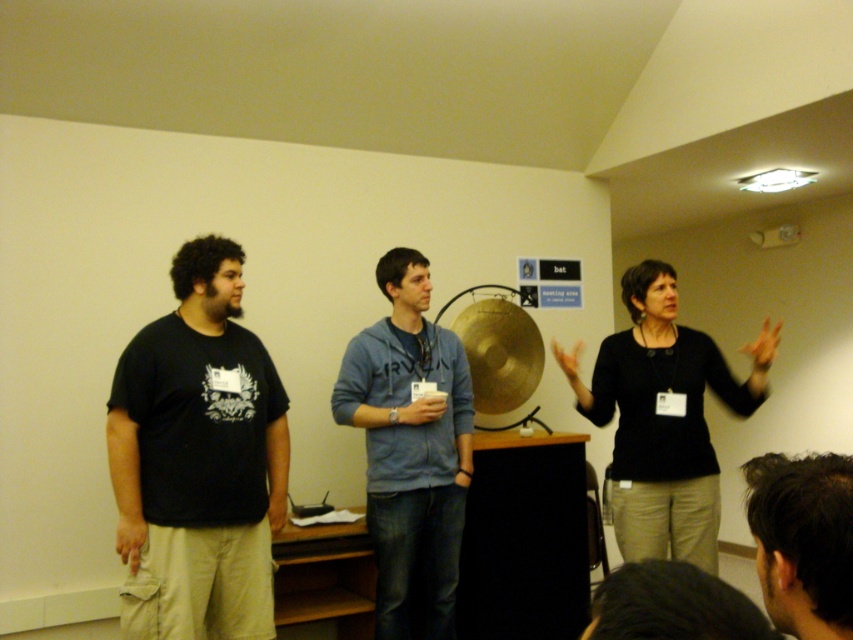
Question: Estimate the real-world distances between objects in this image. Which object is farther from the black matte t-shirt at left?

Choices:
 (A) blue cotton hoodie at center
 (B) gold metallic cymbal at center
 (C) dark brown hair at lower right
 (D) black matte shirt at center

Answer: (C)

Question: Is black matte shirt at center thinner than gold metallic cymbal at center?

Choices:
 (A) no
 (B) yes

Answer: (A)

Question: Which of the following is the farthest from the observer?

Choices:
 (A) black matte t-shirt at left
 (B) gold metallic cymbal at center
 (C) blue cotton hoodie at center

Answer: (B)

Question: Does dark brown hair at lower right have a greater width compared to gold metallic cymbal at center?

Choices:
 (A) no
 (B) yes

Answer: (A)

Question: Can you confirm if black matte t-shirt at left is positioned above gold metallic cymbal at center?

Choices:
 (A) yes
 (B) no

Answer: (B)

Question: Based on their relative distances, which object is farther from the black matte t-shirt at left?

Choices:
 (A) black matte shirt at center
 (B) gold metallic cymbal at center
 (C) blue cotton hoodie at center
 (D) dark brown hair at lower right

Answer: (D)